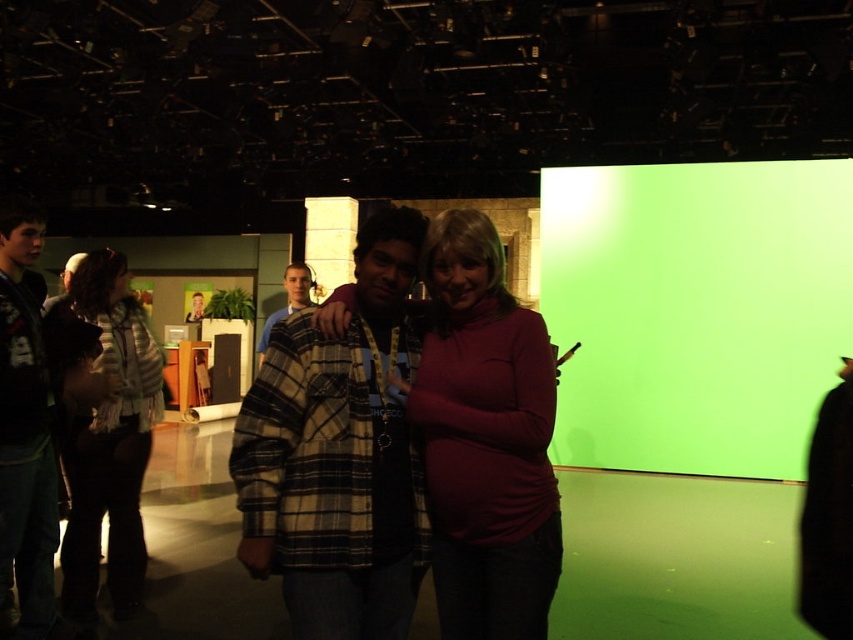
Is point (329, 609) closer to camera compared to point (39, 577)?

Yes.

Describe the element at coordinates (338, 456) in the screenshot. This screenshot has height=640, width=853. I see `plaid fabric shirt at center` at that location.

I want to click on plaid fabric shirt at center, so click(x=338, y=456).

Based on the photo, which of these two, matte red sweater at center or plaid wool sweater at center, stands taller?

matte red sweater at center

Does point (427, 436) lie behind point (299, 269)?

No, (427, 436) is in front of (299, 269).

This screenshot has height=640, width=853. I want to click on matte red sweater at center, so click(x=486, y=440).

Who is shorter, plaid fabric shirt at center or matte red sweater at center?

plaid fabric shirt at center is shorter.

At what (x,y) coordinates should I click in order to perform the action: click on plaid fabric shirt at center. Please return your answer as a coordinate pair (x, y). Looking at the image, I should click on (338, 456).